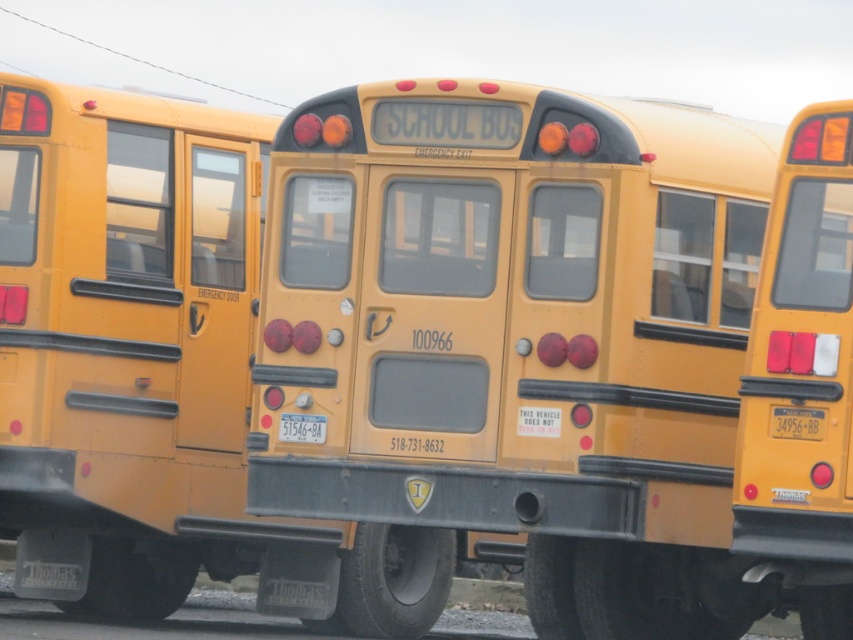
You are a delivery person trying to read the license plates on the yellow school buses. You need to know the distance between the yellow plastic license plate at center and the yellow matte license plate at center to ensure your delivery truck can fit between them. Can your truck, which is 2.5 meters wide, pass through the space between them?

The yellow plastic license plate at center and yellow matte license plate at center are 2.61 meters apart. Since your truck is 2.5 meters wide, it can fit through the space between them as the distance is slightly larger than the truck width.